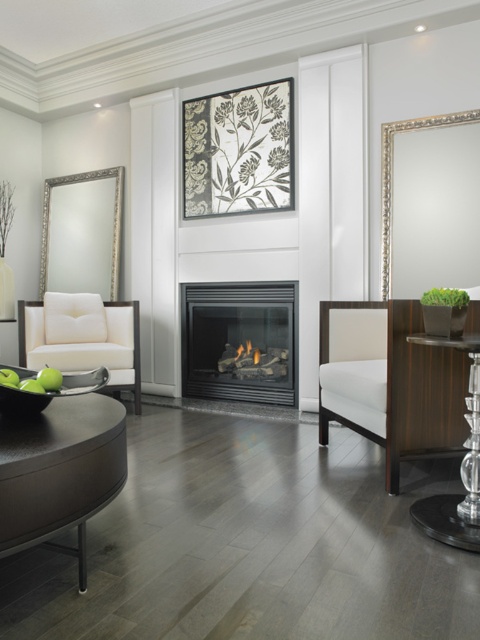
You are standing in the living room and want to place a decorative vase on the closest object to you between the dark brown wooden table at lower left and the matte white armchair at left. Which object should you choose?

The dark brown wooden table at lower left is closer to the viewer than the matte white armchair at left, so you should place the decorative vase on the dark brown wooden table at lower left.

You are a guest entering the living room and want to sit down on the matte white armchair at left. To reach it, you must walk around the dark brown wooden table at lower left. Which direction should you go to avoid the table?

Since the dark brown wooden table at lower left is below the matte white armchair at left, you should walk towards the right side of the table to reach the matte white armchair at left without obstruction.

You are standing at the entrance of the living room and see two points marked in the image. The first point is at coordinate point (292, 195) and the second is at point (106, 324). Which point is closer to you?

Point (292, 195) is in front of point (106, 324), so the first point is closer to you.